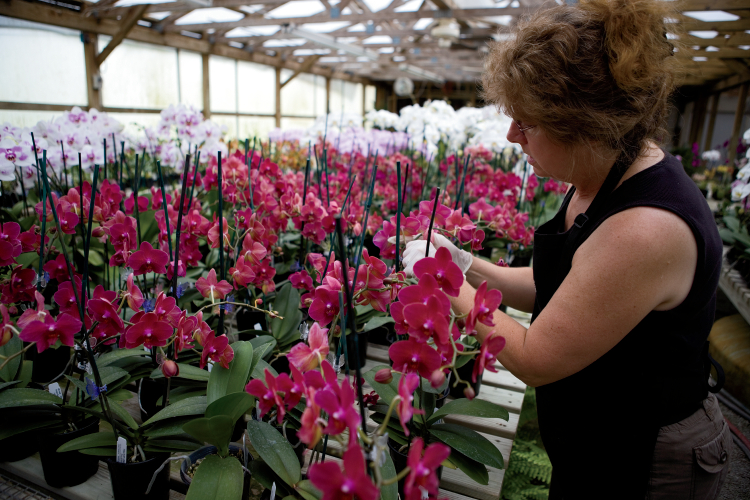
The image size is (750, 500). Identify the location of column. (76, 305), (175, 232), (166, 221), (396, 212), (349, 480), (337, 411), (142, 336).